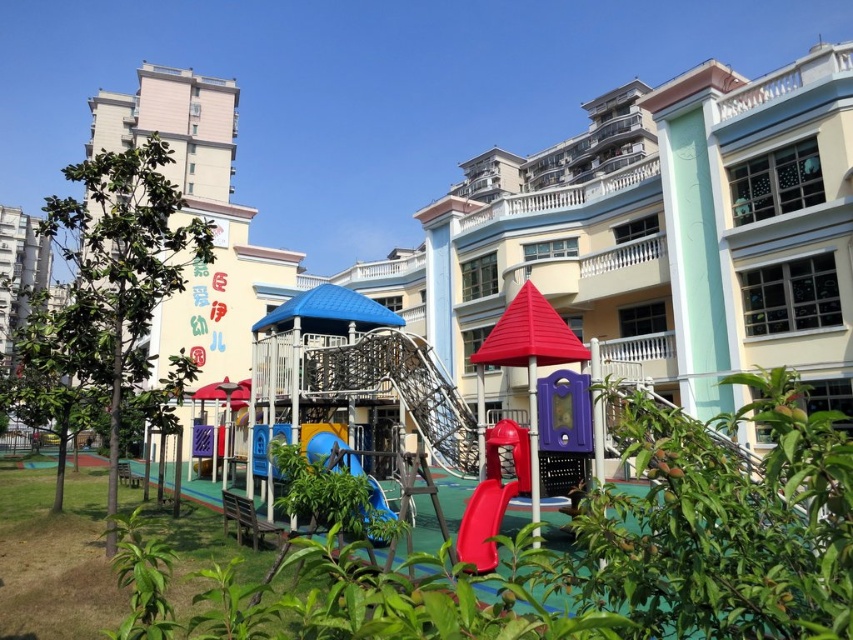
Is point (488, 536) more distant than point (358, 468)?

No.

Image resolution: width=853 pixels, height=640 pixels. What do you see at coordinates (483, 524) in the screenshot? I see `rubber smooth slide at center` at bounding box center [483, 524].

In order to click on rubber smooth slide at center in this screenshot , I will do `click(483, 524)`.